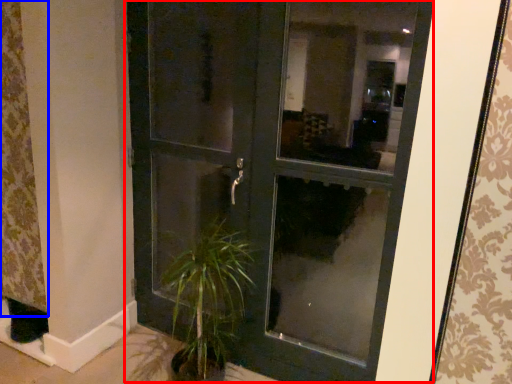
Question: Which object is further to the camera taking this photo, door (highlighted by a red box) or curtain (highlighted by a blue box)?

Choices:
 (A) door
 (B) curtain

Answer: (B)